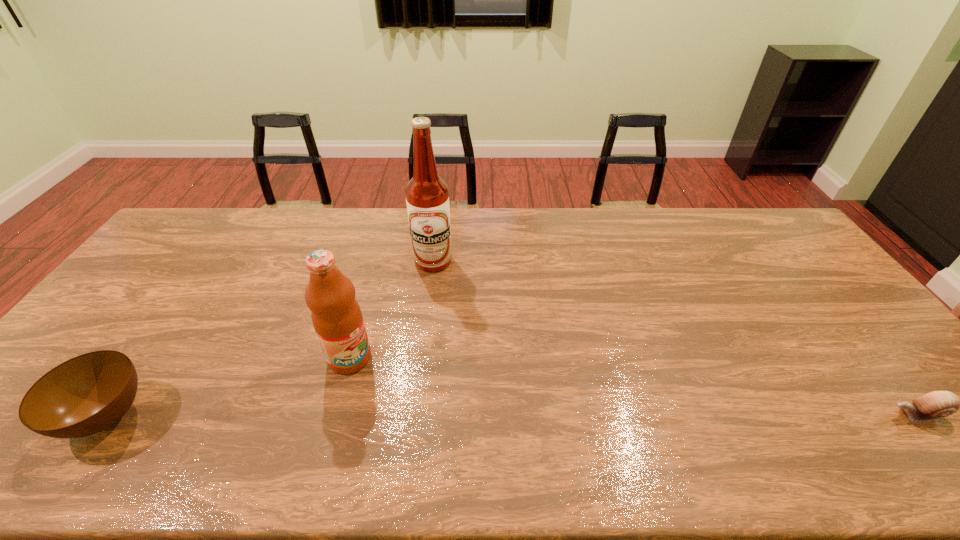
Locate an element on the screen. Image resolution: width=960 pixels, height=540 pixels. vacant space on the desktop that is between the leftmost object and the rightmost object and is positioned on the label side of the alcohol is located at coordinates (503, 415).

This screenshot has height=540, width=960. Find the location of `free space on the desktop that is between the third tallest object and the shortest object and is positioned on the front label of the third object from right to left`. free space on the desktop that is between the third tallest object and the shortest object and is positioned on the front label of the third object from right to left is located at coordinates (413, 415).